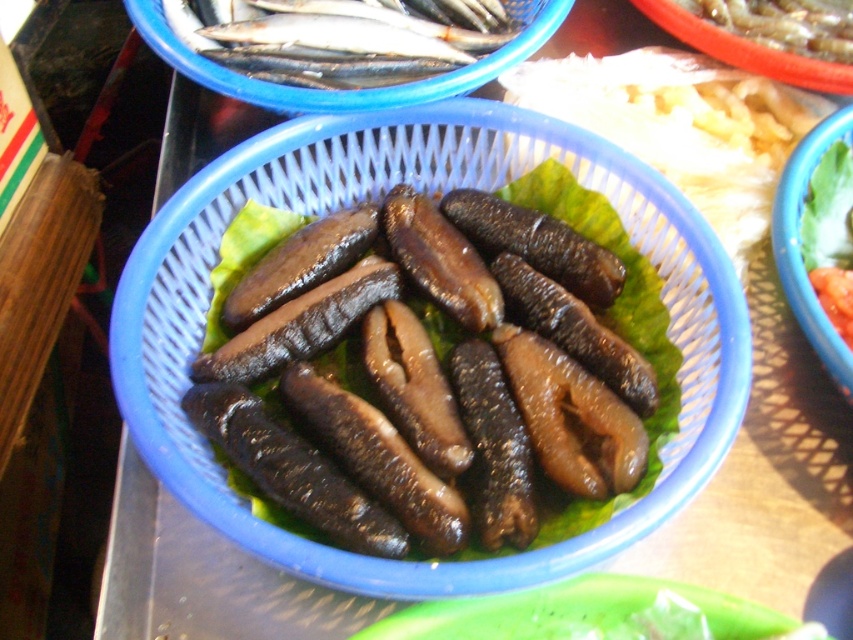
You are a food vendor arranging items in a blue plastic basket. You need to place a new item exactly at the center of the basket. The basket already has a black rubbery sea cucumber at center. Where should you place the new item to ensure it is centered?

The black rubbery sea cucumber at center is already positioned at the center point of the basket, so placing the new item at the same location would overlap with it. To center the new item without overlapping, you should place it at the basket center coordinates provided in the description, which is point [427,372].

You are a customer at a seafood market. You see the black rubbery sea cucumber at center and the shiny silver fish at upper center in the same basket. Which one is positioned higher in the basket?

The shiny silver fish at upper center is positioned higher in the basket than the black rubbery sea cucumber at center because the black rubbery sea cucumber at center is below the shiny silver fish at upper center.

From the picture: You are a food vendor preparing a dish and need to know the height of the items in the basket. Which item, the black matte sea cucumber at center or the shiny silver fish at upper center, is taller?

The black matte sea cucumber at center is much taller than the shiny silver fish at upper center.